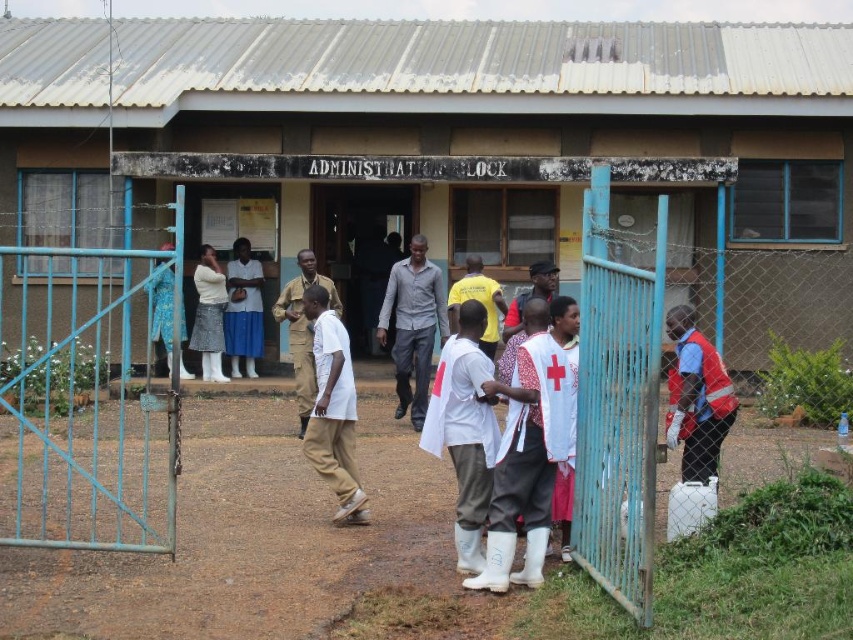
What do you see at coordinates (332, 408) in the screenshot?
I see `white matte pants at center` at bounding box center [332, 408].

Is point (318, 422) closer to viewer compared to point (380, 308)?

That is True.

Is point (328, 323) farther from viewer compared to point (408, 353)?

No, (328, 323) is closer to viewer.

What are the coordinates of `white matte pants at center` in the screenshot? It's located at (332, 408).

Is white fabric skirt at center thinner than yellow matte shirt at center?

Indeed, white fabric skirt at center has a lesser width compared to yellow matte shirt at center.

Between white fabric skirt at center and yellow matte shirt at center, which one is positioned higher?

white fabric skirt at center is higher up.

Who is more forward, (247,268) or (488,324)?

Positioned in front is point (488,324).

The height and width of the screenshot is (640, 853). I want to click on white fabric skirt at center, so click(x=242, y=308).

Can you confirm if reflective orange vest at right is shorter than yellow matte shirt at center?

Incorrect, reflective orange vest at right's height does not fall short of yellow matte shirt at center's.

Looking at this image, is reflective orange vest at right below yellow matte shirt at center?

Yes.

Between point (682, 355) and point (485, 291), which one is positioned in front?

Point (682, 355) is more forward.

This screenshot has height=640, width=853. What are the coordinates of `reflective orange vest at right` in the screenshot? It's located at tap(697, 396).